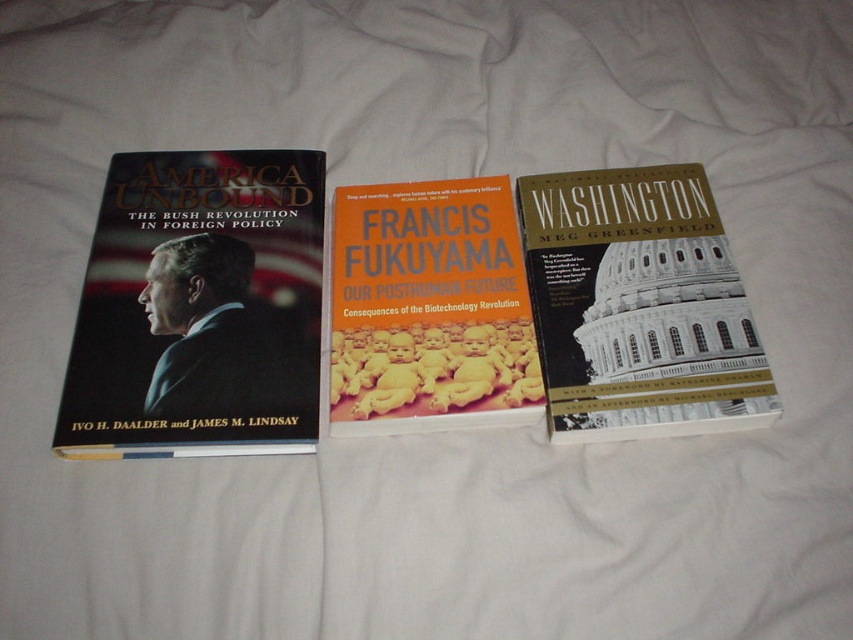
Is point (215, 390) in front of point (555, 300)?

Yes.

Which is behind, point (189, 224) or point (715, 326)?

Point (189, 224)

Is point (154, 164) farther from camera compared to point (727, 285)?

Yes.

Where is `hardcover book at left`? The height and width of the screenshot is (640, 853). hardcover book at left is located at coordinates (198, 308).

Does hardcover book at center appear on the left side of orange matte book at center?

In fact, hardcover book at center is to the right of orange matte book at center.

Does hardcover book at center appear under orange matte book at center?

Actually, hardcover book at center is above orange matte book at center.

Is point (625, 355) farther from viewer compared to point (335, 340)?

No.

Identify the location of hardcover book at center. (637, 307).

Is point (134, 259) positioned after point (537, 392)?

Yes, point (134, 259) is farther from viewer.

Can you confirm if hardcover book at left is wider than orange matte book at center?

Correct, the width of hardcover book at left exceeds that of orange matte book at center.

Locate an element on the screen. The height and width of the screenshot is (640, 853). hardcover book at left is located at coordinates (198, 308).